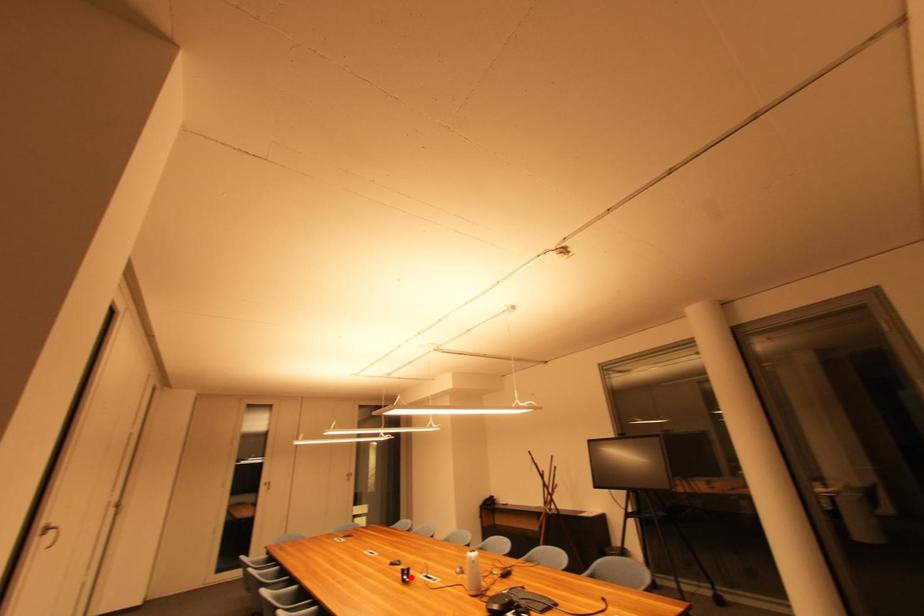
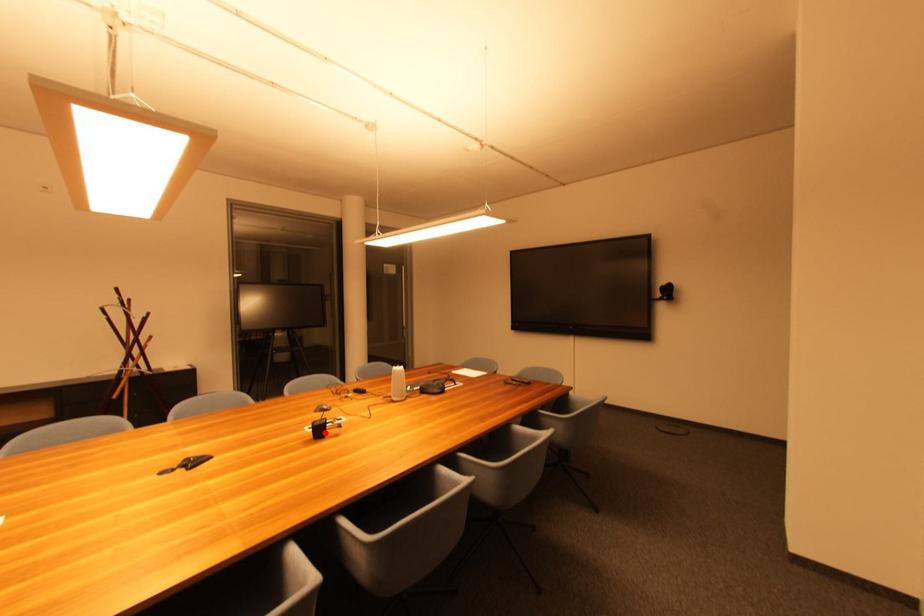
Based on the photo, I am providing you with two images of the same scene from different viewpoints. A red point is marked on the first image and another point is marked on the second image. Is the red point in image1 aligned with the point shown in image2?

Yes